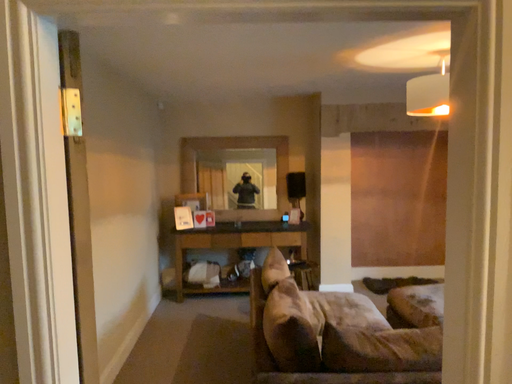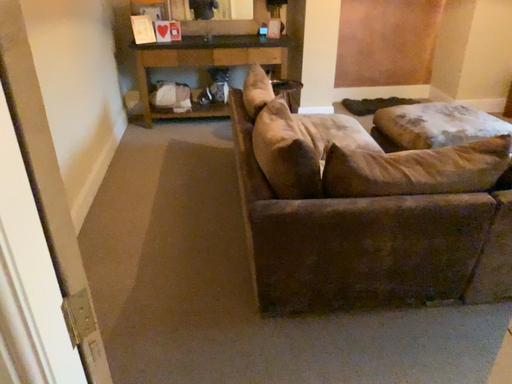
Question: Which way did the camera rotate in the video?

Choices:
 (A) rotated downward
 (B) rotated upward

Answer: (A)